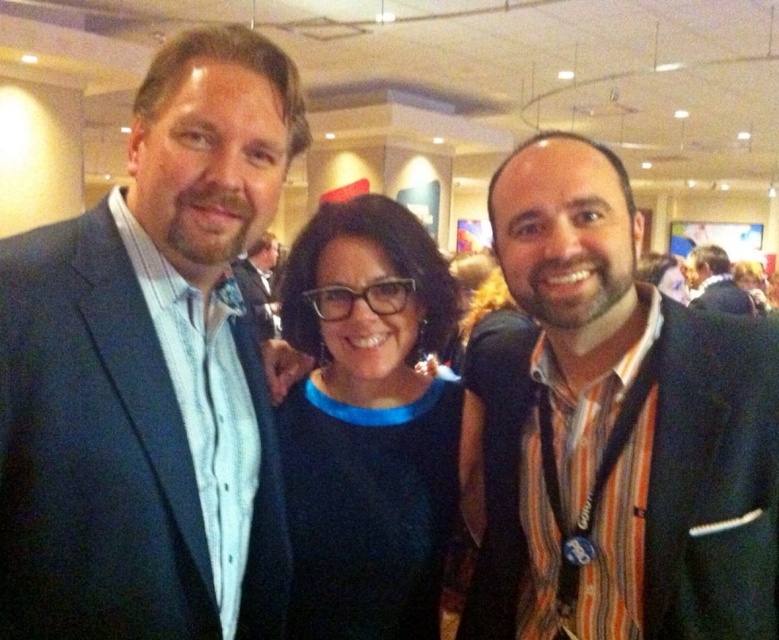
Question: Observing the image, what is the correct spatial positioning of striped cotton shirt at center in reference to black matte dress at center?

Choices:
 (A) right
 (B) left

Answer: (A)

Question: From the image, what is the correct spatial relationship of matte blue suit at left in relation to dark blue suit at right?

Choices:
 (A) below
 (B) above

Answer: (A)

Question: Which point is closer to the camera taking this photo?

Choices:
 (A) 397,572
 (B) 716,268

Answer: (A)

Question: Among these objects, which one is farthest from the camera?

Choices:
 (A) striped cotton shirt at center
 (B) dark blue suit at right
 (C) black matte dress at center

Answer: (B)

Question: Is striped cotton shirt at center to the left of black matte dress at center from the viewer's perspective?

Choices:
 (A) yes
 (B) no

Answer: (B)

Question: Which of the following is the closest to the observer?

Choices:
 (A) black matte dress at center
 (B) dark blue suit at right
 (C) matte blue suit at left

Answer: (C)